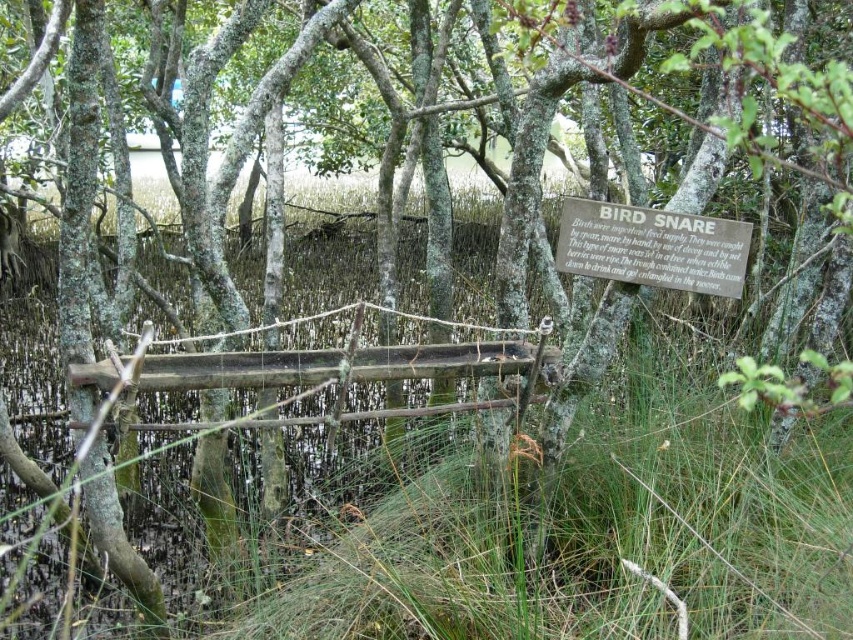
You are a park ranger inspecting the bird snares in the mangrove forest. You notice the smooth wooden plank at center and the wooden sign at center. According to the setup, which object is located to the left of the other?

The smooth wooden plank at center is positioned on the left side of wooden sign at center.

You are a park ranger inspecting a bird snare in a wetland area. You notice two objects at the center of the snare structure. Which object is wider between the smooth wooden plank at center and the wooden sign at center?

The smooth wooden plank at center is wider than the wooden sign at center according to the description provided.